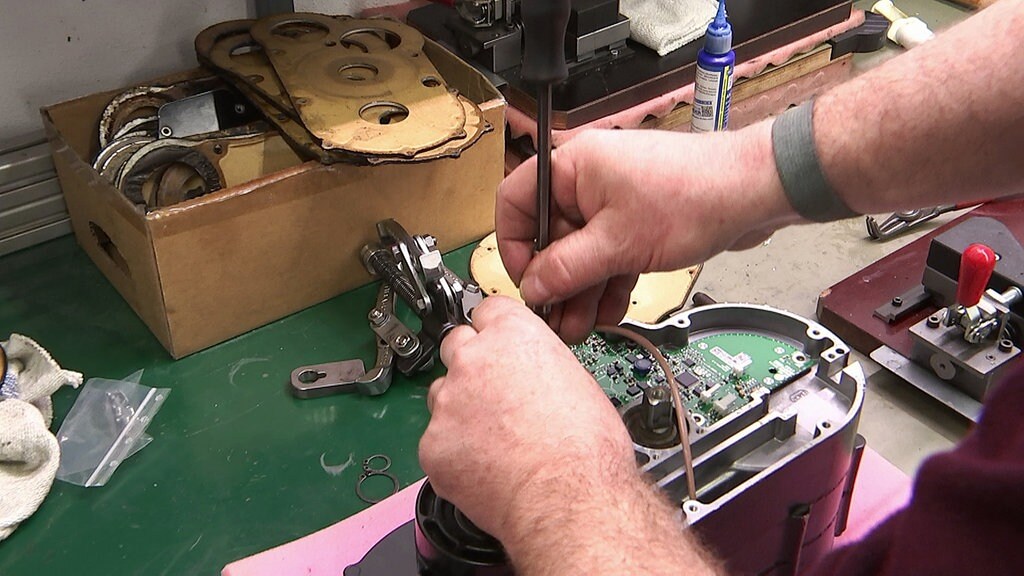
At what (x,y) coordinates should I click in order to perform the action: click on sliver baseboard. Please return your answer as a coordinate pair (x, y). Image resolution: width=1024 pixels, height=576 pixels. Looking at the image, I should click on (20, 200).